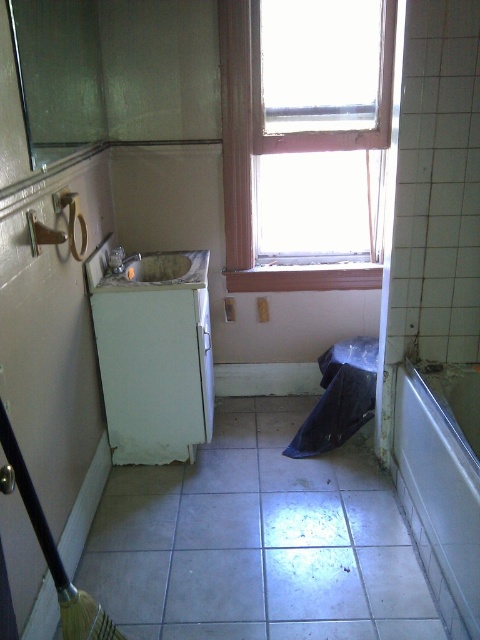
Question: Which of the following is the farthest from the observer?

Choices:
 (A) (468, 394)
 (B) (193, 257)
 (C) (252, 100)

Answer: (B)

Question: Is transparent glass window at upper center to the right of white glossy sink at center from the viewer's perspective?

Choices:
 (A) yes
 (B) no

Answer: (A)

Question: Which of the following is the closest to the observer?

Choices:
 (A) white glossy sink at center
 (B) transparent glass window at upper center
 (C) white glossy bathtub at lower right

Answer: (C)

Question: Can you confirm if white glossy bathtub at lower right is positioned above transparent glass window at upper center?

Choices:
 (A) yes
 (B) no

Answer: (B)

Question: Among these points, which one is nearest to the camera?

Choices:
 (A) (239, 51)
 (B) (117, 276)

Answer: (B)

Question: Can you confirm if white glossy bathtub at lower right is bigger than white glossy sink at center?

Choices:
 (A) no
 (B) yes

Answer: (B)